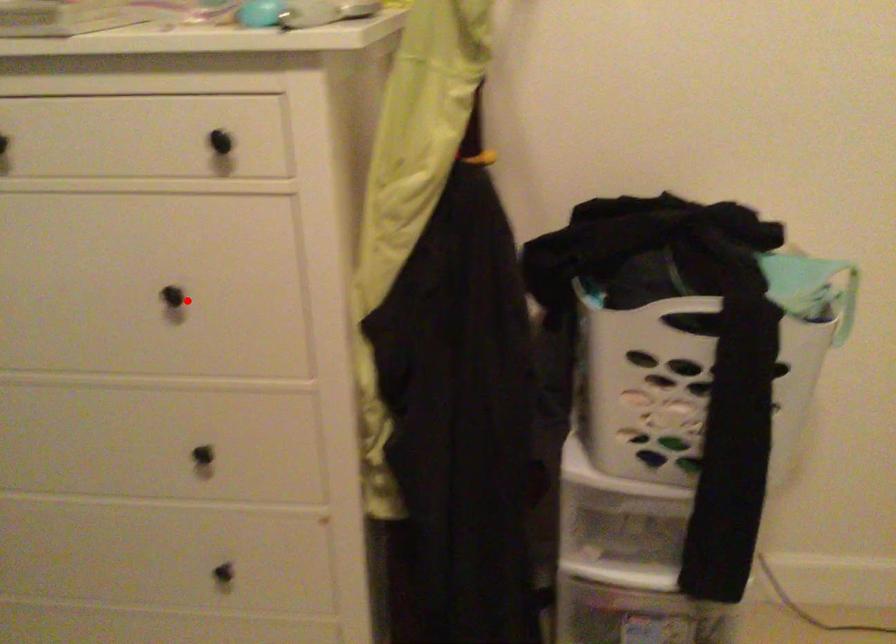
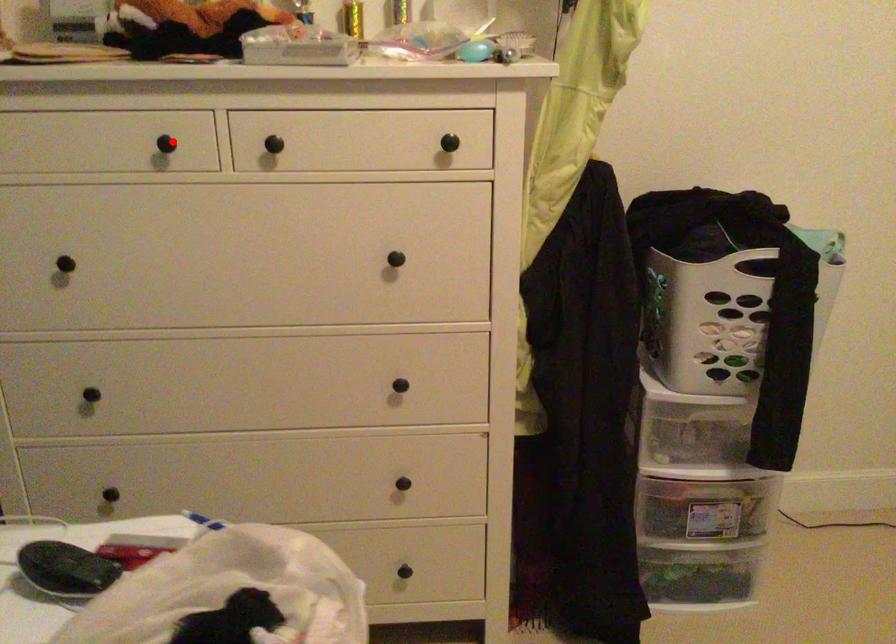
I am providing you with two images of the same scene from different viewpoints. A red point is marked on the first image and another point is marked on the second image. Is the marked point in image1 the same physical position as the marked point in image2?

No